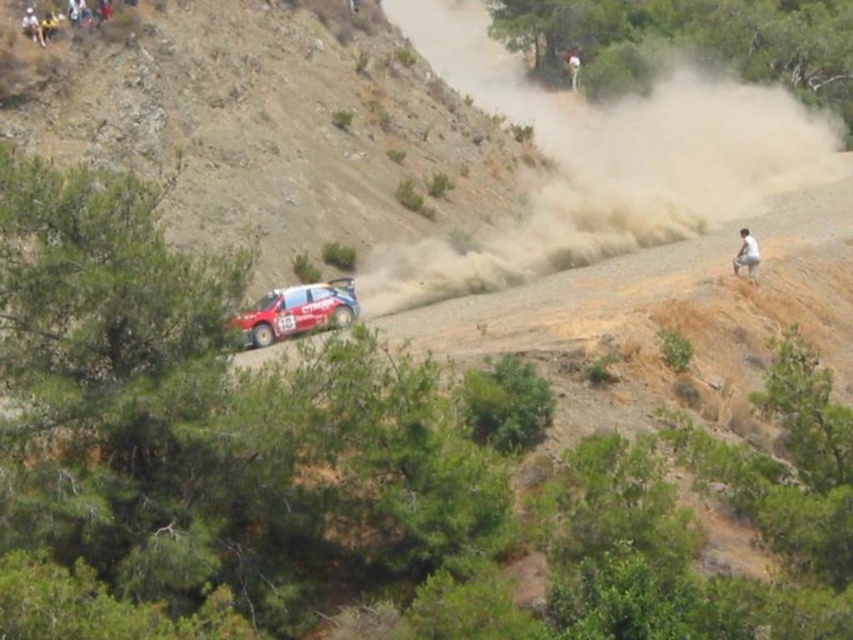
You are a photographer aiming to capture the rally car in the scene. You notice two white items in your frame. One is the white cotton shirt at lower right and the other is the white fabric person at upper center. Which white item is positioned lower in the image?

The white cotton shirt at lower right is positioned lower in the image than the white fabric person at upper center.

From the picture: You are a photographer trying to capture the rally car in the image. You notice two objects in the foreground that might obstruct your view. Which of the two objects, the white cotton shirt at lower right or the white fabric person at upper center, is larger and could potentially block more of the car from your camera lens?

The white cotton shirt at lower right is bigger than the white fabric person at upper center, so it could potentially block more of the car from your camera lens.